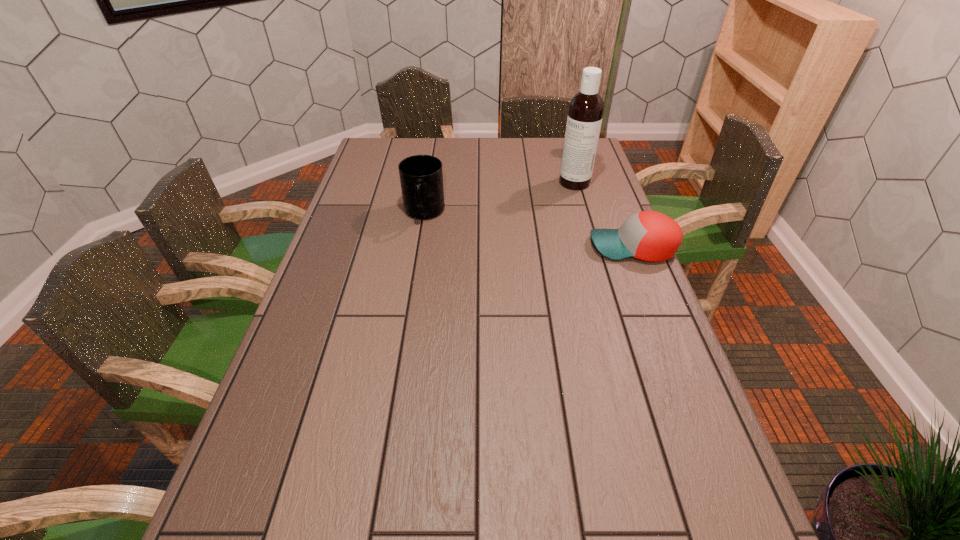
Locate an element on the screen. The height and width of the screenshot is (540, 960). vacant area situated 0.380m on the label side of the tallest object is located at coordinates click(498, 238).

Where is `vacant region located 0.380m on the label side of the tallest object`? vacant region located 0.380m on the label side of the tallest object is located at coordinates pos(498,238).

Identify the location of blank space located on the label side of the tallest object. Image resolution: width=960 pixels, height=540 pixels. (550, 200).

Identify the location of baseball cap that is at the right edge. This screenshot has height=540, width=960. (651, 236).

Where is `dishwasher detergent located in the right edge section of the desktop`? dishwasher detergent located in the right edge section of the desktop is located at coordinates (586, 108).

In the image, there is a desktop. Find the location of `vacant space at the far edge`. vacant space at the far edge is located at coordinates (511, 151).

Where is `free space at the left edge`? The image size is (960, 540). free space at the left edge is located at coordinates (314, 345).

This screenshot has width=960, height=540. Identify the location of vacant space at the right edge. (611, 289).

Locate an element on the screen. free space between the baseball cap and the farthest object is located at coordinates (604, 215).

Identify the location of vacant point located between the farthest object and the shortest object. (604, 215).